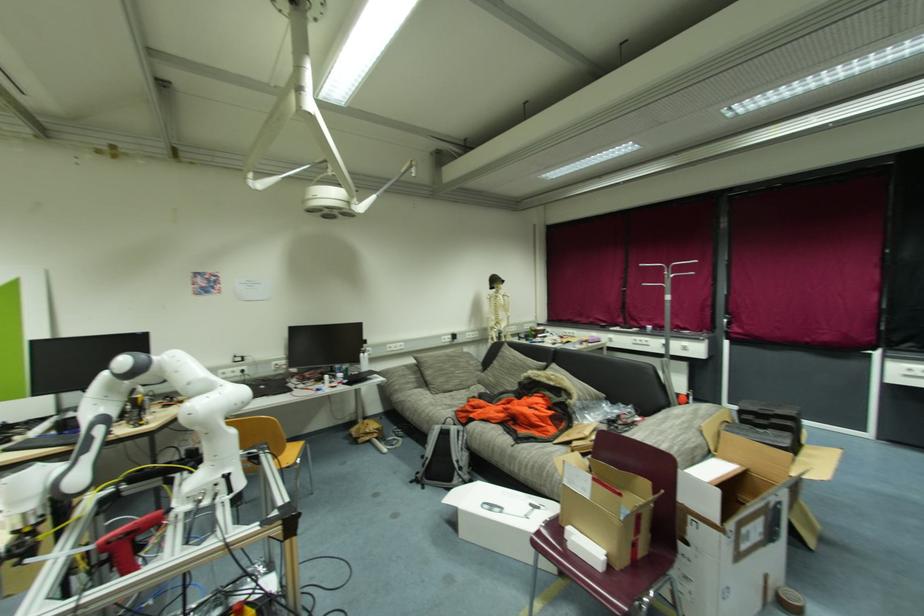
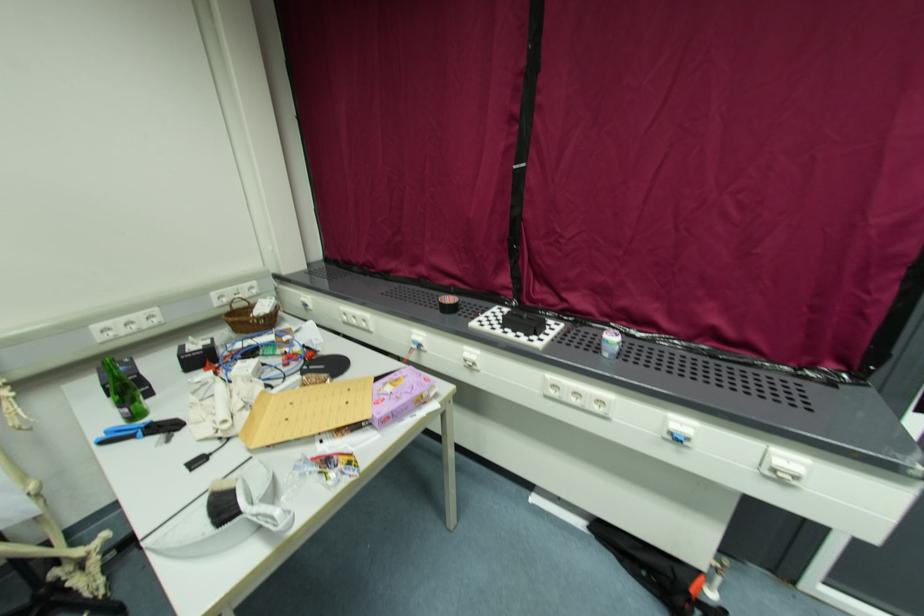
Locate, in the second image, the point that corresponds to (687,349) in the first image.

(783, 477)